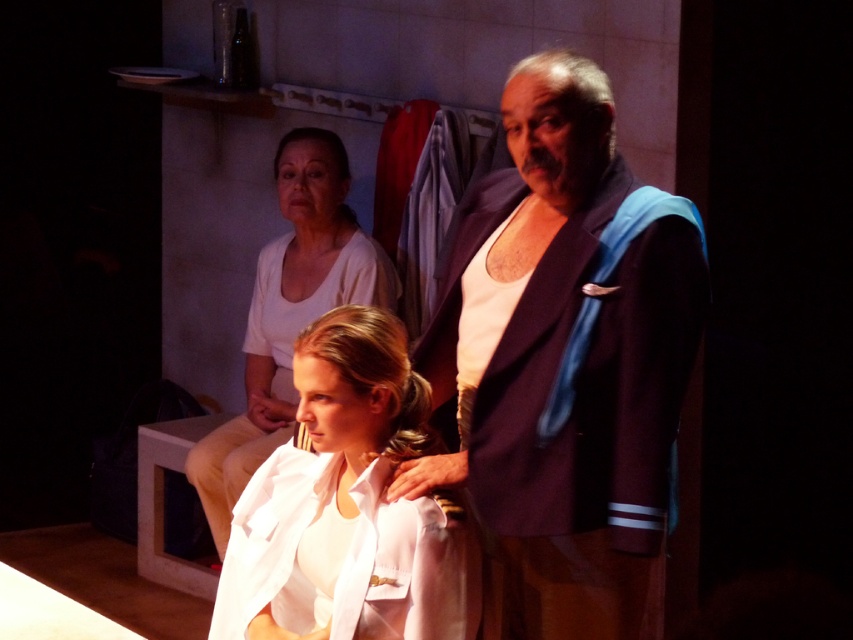
Question: Which point is closer to the camera?

Choices:
 (A) white matte shirt at center
 (B) smooth white blouse at center

Answer: (A)

Question: Does dark blue fabric jacket at center appear on the left side of smooth white blouse at center?

Choices:
 (A) yes
 (B) no

Answer: (B)

Question: Does dark blue fabric jacket at center appear under white matte shirt at center?

Choices:
 (A) yes
 (B) no

Answer: (B)

Question: Is the position of white matte shirt at center more distant than that of smooth white blouse at center?

Choices:
 (A) yes
 (B) no

Answer: (B)

Question: Which object is farther from the camera taking this photo?

Choices:
 (A) smooth white blouse at center
 (B) dark blue fabric jacket at center
 (C) white matte shirt at center

Answer: (A)

Question: Which point is closer to the camera?

Choices:
 (A) (474, 259)
 (B) (326, 524)

Answer: (B)